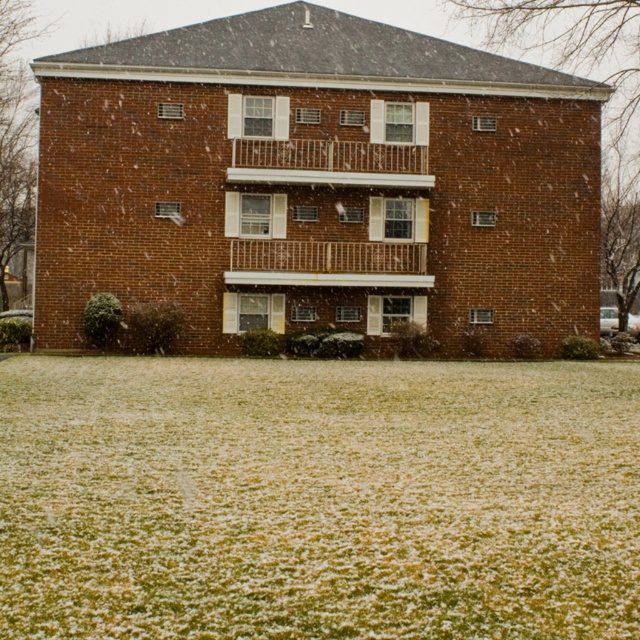
Based on the photo, you are standing at the base of the two story brick building and want to walk from the green grass at lower center to the white metal railing at upper center. How far will you have to walk?

The green grass at lower center is 21.98 meters away from the white metal railing at upper center, so you will have to walk 21.98 meters to reach it.

You are a delivery person trying to park your van in front of the building. The van requires a space wider than the white metal railing at upper center. Can you park your van on the green grass at lower center?

The green grass at lower center is wider than the white metal railing at upper center, so yes, the van can park on the green grass at lower center as it has sufficient width.